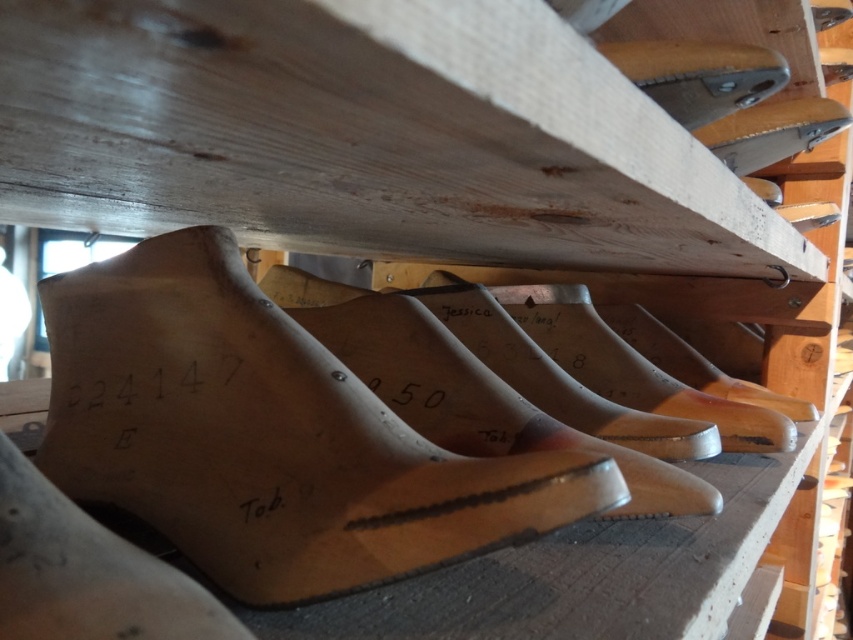
You are a shoemaker looking at the wooden shoe lasts arranged on the shelf. You need to locate the wooden shoe at upper center and the wooden shoe at upper right. Which one is positioned to the left of the other?

The wooden shoe at upper center is positioned to the left of the wooden shoe at upper right.

Consider the image. You are a shoemaker examining the wooden shoe lasts arranged on the shelf. You need to determine which of the two lasts, the natural wood shoe at center or the wooden shoe at upper center, is taller. Based on their positions, which one is taller?

The natural wood shoe at center is taller than the wooden shoe at upper center according to the description.

You are a shoemaker who needs to retrieve a wooden shoe last from the shelf. You have a 12 inch long tool to reach it. Is the wooden shoe at upper center within reach of your tool?

The wooden shoe at upper center is 17.67 inches away from the camera. Since your tool is only 12 inches long, it is not long enough to reach the wooden shoe at upper center.